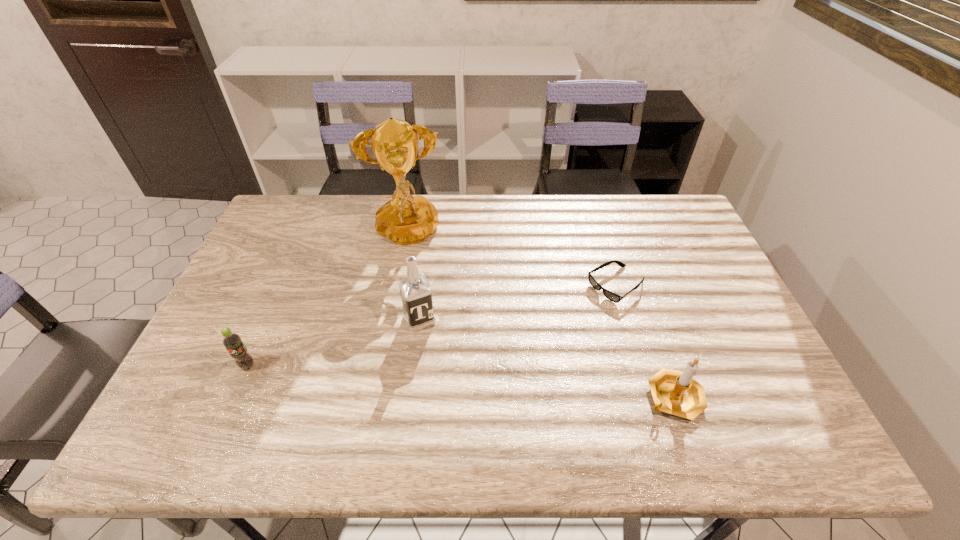
The image size is (960, 540). Find the location of `free spot on the desktop that is between the leftmost object and the candle holder and is positioned on the front-facing side of the shortest object`. free spot on the desktop that is between the leftmost object and the candle holder and is positioned on the front-facing side of the shortest object is located at coordinates (472, 382).

Locate an element on the screen. free spot on the desktop that is between the soda and the candle holder and is positioned on the front side of the farthest object is located at coordinates (428, 379).

Locate an element on the screen. The image size is (960, 540). vacant space on the desktop that is between the soda and the candle holder and is positioned on the front label of the vodka is located at coordinates (448, 381).